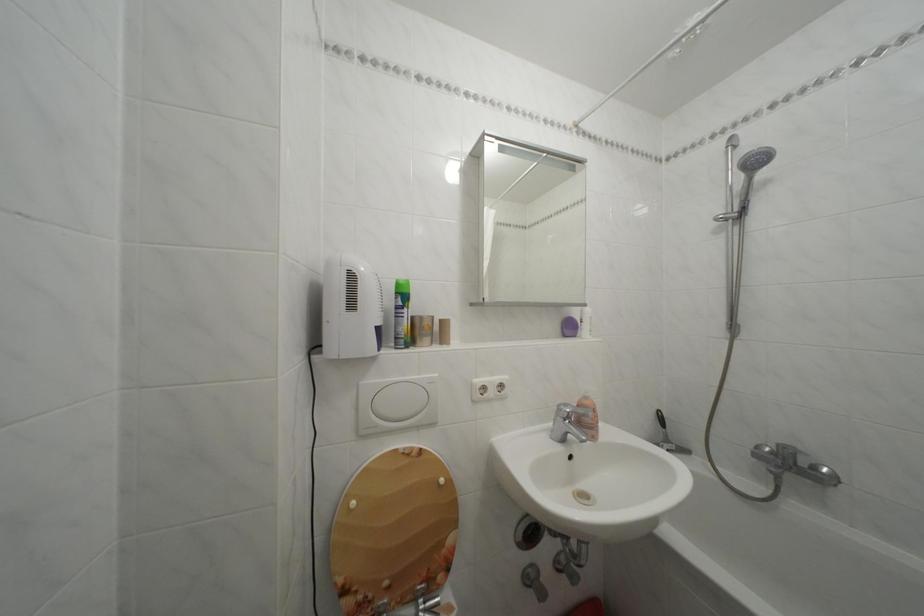
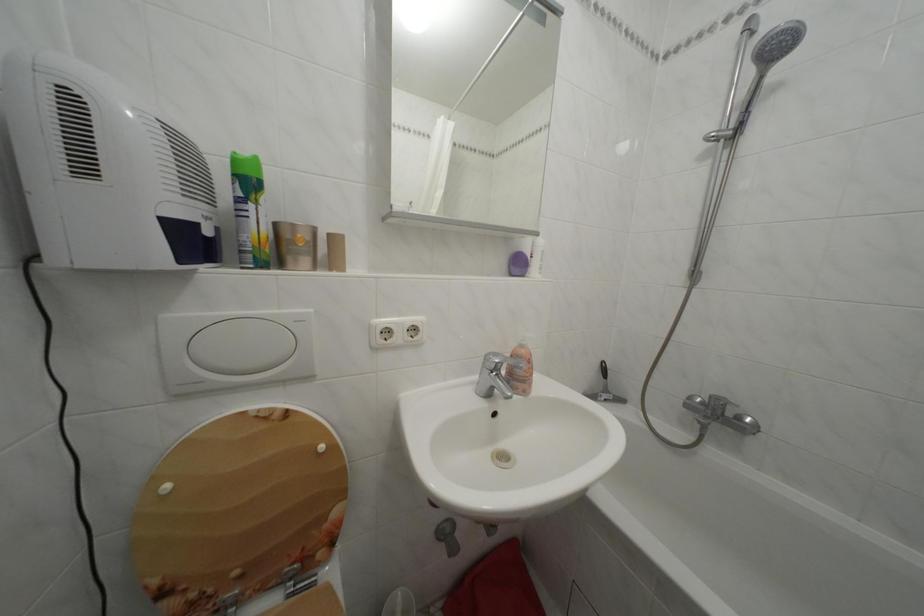
In the second image, find the point that corresponds to pixel 362 509 in the first image.

(176, 493)